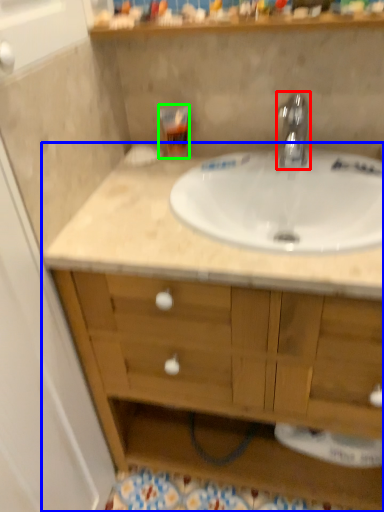
Question: Based on their relative distances, which object is farther from tap (highlighted by a red box)? Choose from bathroom cabinet (highlighted by a blue box) and toiletry (highlighted by a green box).

Choices:
 (A) bathroom cabinet
 (B) toiletry

Answer: (A)